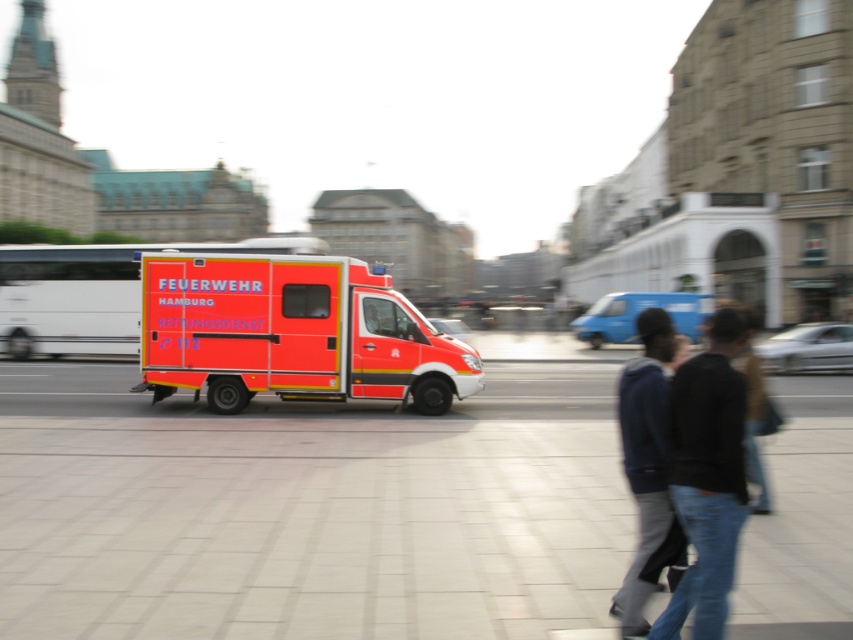
Does dark blue jacket at center have a lesser height compared to dark blue jacket at lower right?

Yes.

Identify the location of dark blue jacket at center. coord(706,476).

Who is more forward, [664,630] or [674,544]?

Point [664,630]

Identify the location of dark blue jacket at center. Image resolution: width=853 pixels, height=640 pixels. (706, 476).

Is smooth concrete pavement at center smaller than orange matte ambulance at center?

No.

Who is shorter, smooth concrete pavement at center or orange matte ambulance at center?

smooth concrete pavement at center is shorter.

Is point (344, 625) positioned after point (160, 298)?

That is False.

The image size is (853, 640). I want to click on smooth concrete pavement at center, so pyautogui.click(x=309, y=509).

Is point (552, 636) less distant than point (711, 426)?

That is False.

Locate an element on the screen. Image resolution: width=853 pixels, height=640 pixels. smooth concrete pavement at center is located at coordinates (309, 509).